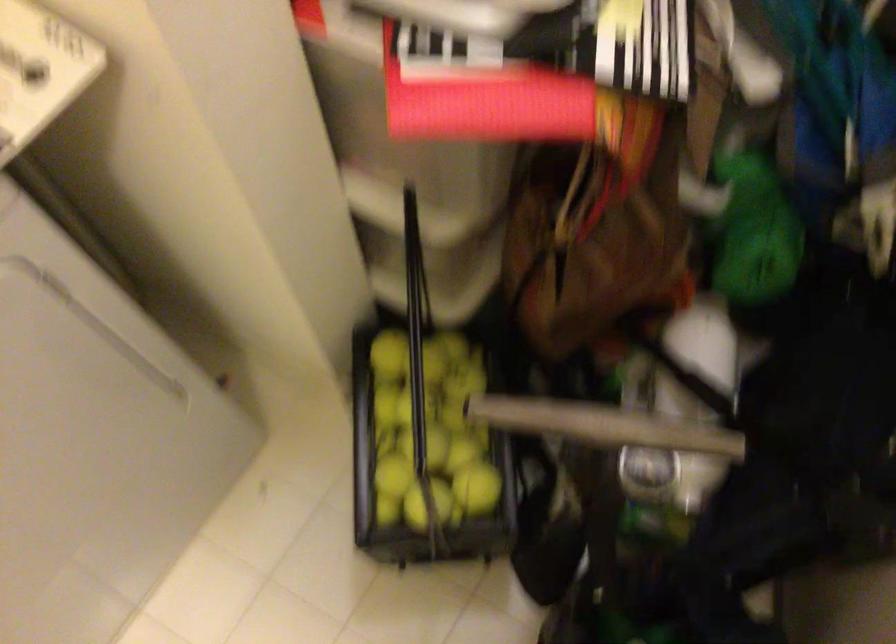
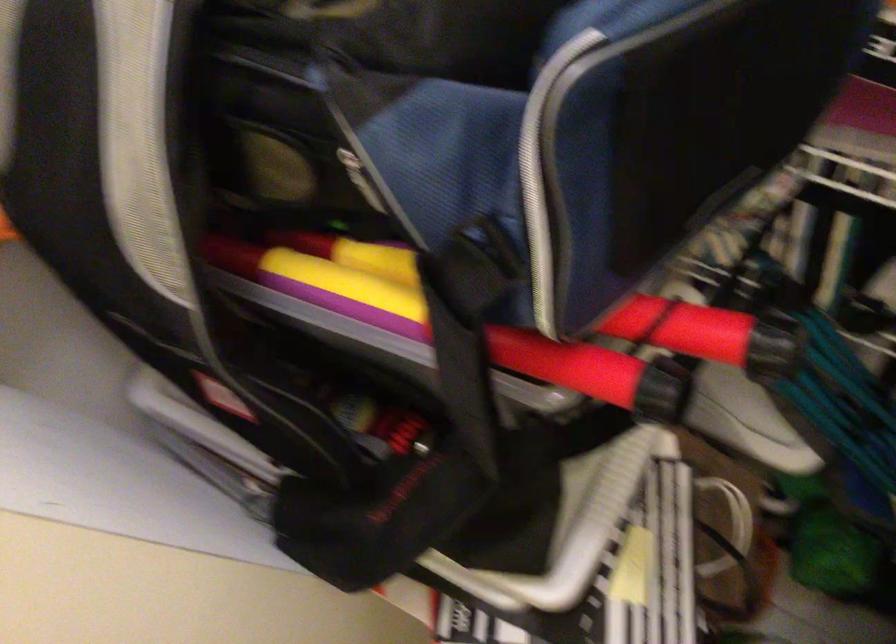
Which direction would the cameraman need to move to produce the second image?

The cameraman walked toward right, backward.